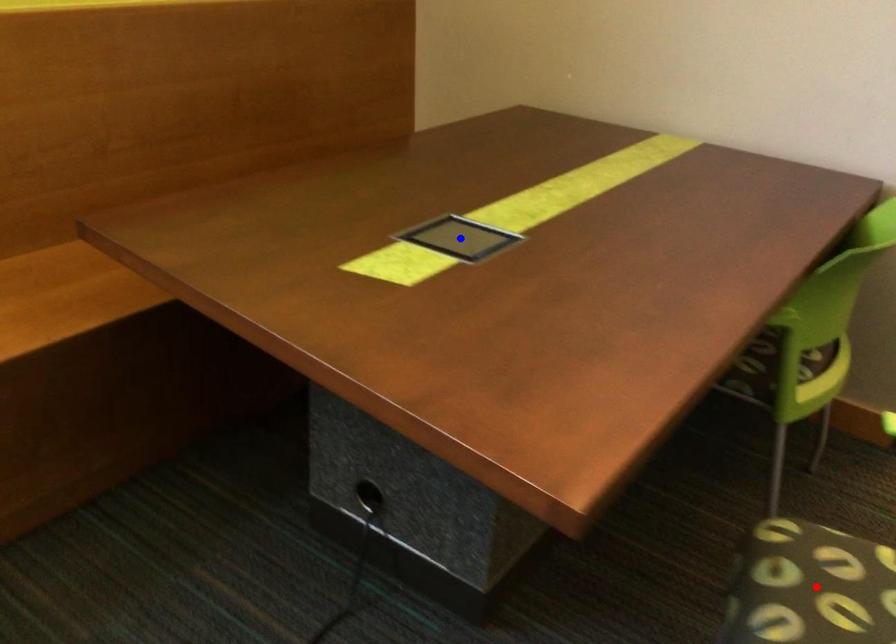
Question: Two points are marked on the image. Which point is closer to the camera?

Choices:
 (A) Blue point is closer.
 (B) Red point is closer.

Answer: (B)